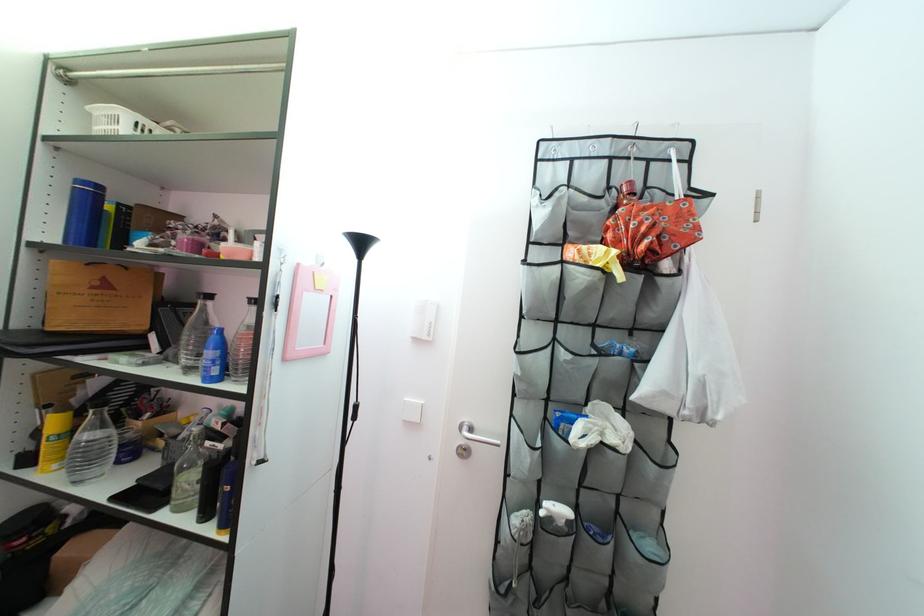
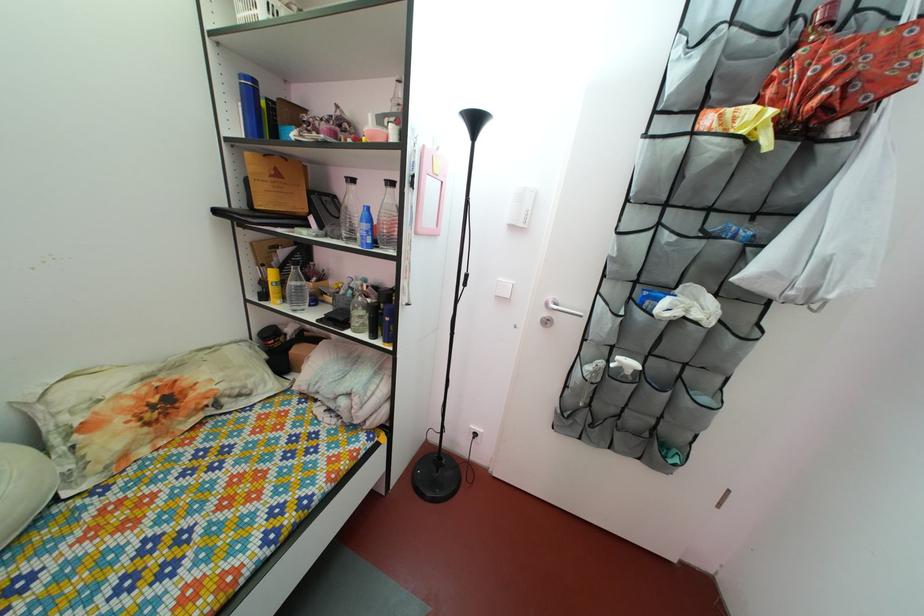
Locate, in the second image, the point that corresponds to (480,438) in the first image.

(565, 313)